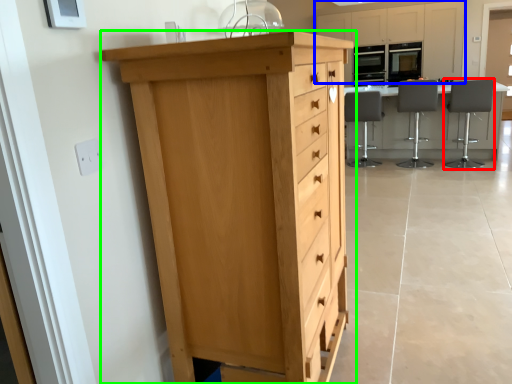
Question: Which is farther away from chair (highlighted by a red box)? cabinetry (highlighted by a blue box) or chest of drawers (highlighted by a green box)?

Choices:
 (A) cabinetry
 (B) chest of drawers

Answer: (B)